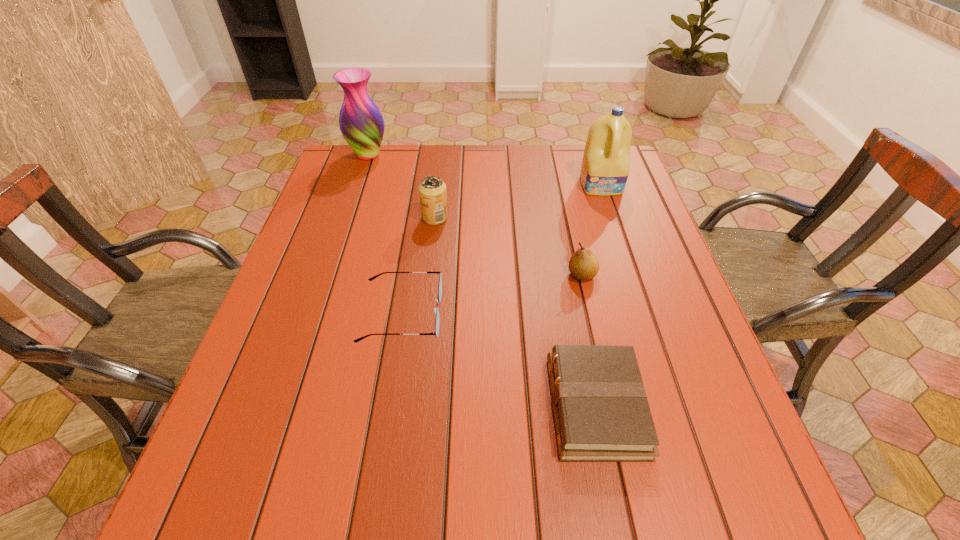
Identify the location of the third closest object relative to the vase. (605, 168).

You are a GUI agent. You are given a task and a screenshot of the screen. Output one action in this format:
    pyautogui.click(x=<x>, y=<y>)
    Task: Click on the vacant space that satisfies the following two spatial constraints: 1. on the label of the detergent; 2. on the spine side of the Bible
    
    Given the screenshot: What is the action you would take?
    click(x=676, y=406)

You are a GUI agent. You are given a task and a screenshot of the screen. Output one action in this format:
    pyautogui.click(x=<x>, y=<y>)
    Task: Click on the vacant point that satisfies the following two spatial constraints: 1. on the label of the second farthest object; 2. on the spine side of the Bible
    This screenshot has height=540, width=960.
    Given the screenshot: What is the action you would take?
    pyautogui.click(x=676, y=406)

Locate an element on the screen. The width and height of the screenshot is (960, 540). vacant space that satisfies the following two spatial constraints: 1. on the label of the second farthest object; 2. on the lenses of the spectacles is located at coordinates (645, 314).

This screenshot has height=540, width=960. Identify the location of vacant space that satisfies the following two spatial constraints: 1. on the front side of the farthest object; 2. on the right side of the third tallest object. (348, 218).

Image resolution: width=960 pixels, height=540 pixels. Find the location of `vacant region that satisfies the following two spatial constraints: 1. on the front side of the third shortest object; 2. on the lenses of the spectacles`. vacant region that satisfies the following two spatial constraints: 1. on the front side of the third shortest object; 2. on the lenses of the spectacles is located at coordinates (590, 314).